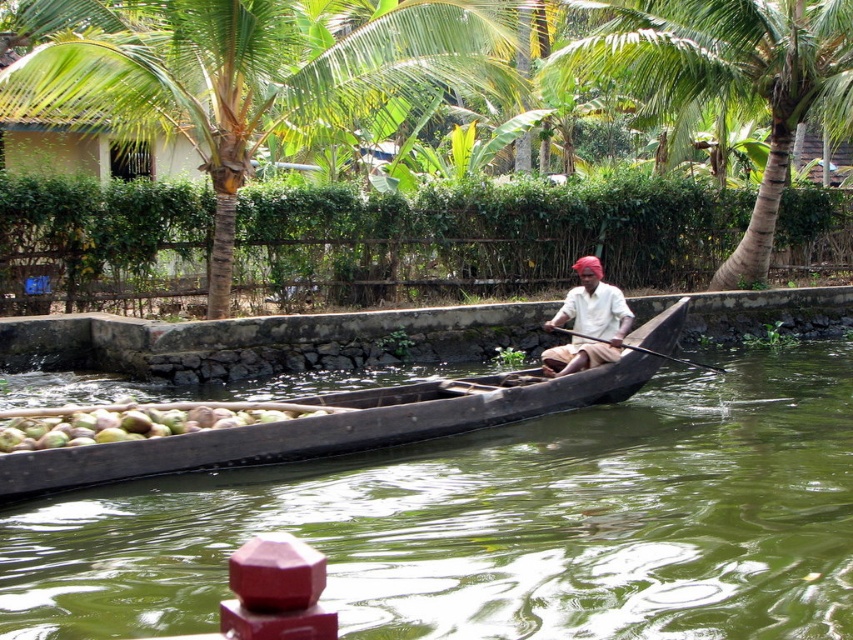
Does point (419, 1) lie in front of point (584, 337)?

That is False.

You are a GUI agent. You are given a task and a screenshot of the screen. Output one action in this format:
    pyautogui.click(x=<x>, y=<y>)
    Task: Click on the green leafy coconut tree at center
    
    Given the screenshot: What is the action you would take?
    pyautogui.click(x=247, y=74)

Where is `green leafy coconut tree at center`? This screenshot has height=640, width=853. green leafy coconut tree at center is located at coordinates (247, 74).

Based on the photo, can you confirm if green leafy coconut tree at upper center is positioned to the right of light brown wooden boat at center?

Yes, green leafy coconut tree at upper center is to the right of light brown wooden boat at center.

The height and width of the screenshot is (640, 853). Describe the element at coordinates (728, 81) in the screenshot. I see `green leafy coconut tree at upper center` at that location.

This screenshot has width=853, height=640. Find the location of `green leafy coconut tree at upper center`. green leafy coconut tree at upper center is located at coordinates (728, 81).

From the picture: Can you confirm if green leafy coconut tree at upper center is thinner than green rough coconut at center?

Yes, green leafy coconut tree at upper center is thinner than green rough coconut at center.

Image resolution: width=853 pixels, height=640 pixels. What are the coordinates of `green leafy coconut tree at upper center` in the screenshot? It's located at (x=728, y=81).